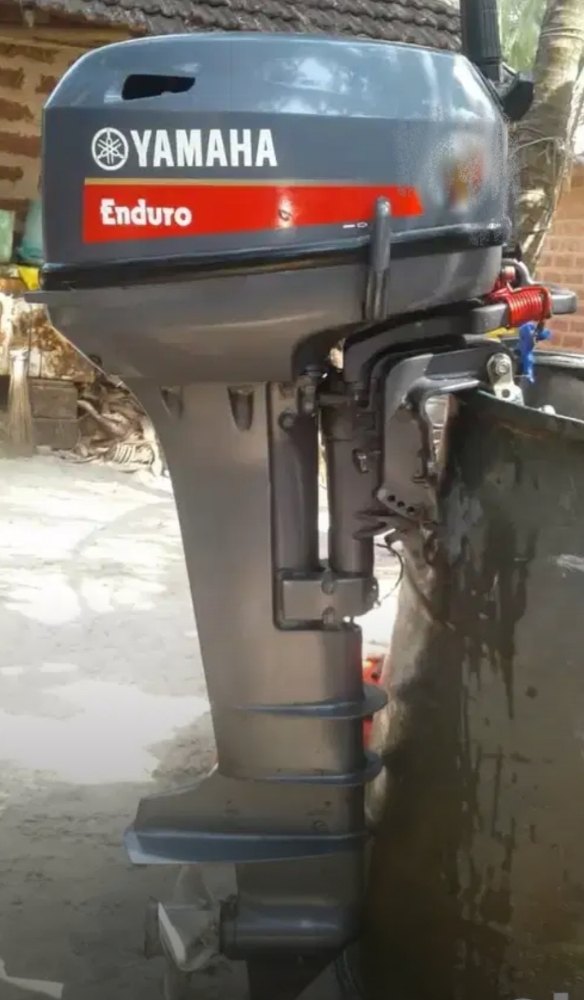
Find the location of a particular element. The width and height of the screenshot is (584, 1000). brick walls is located at coordinates (566, 244), (18, 84).